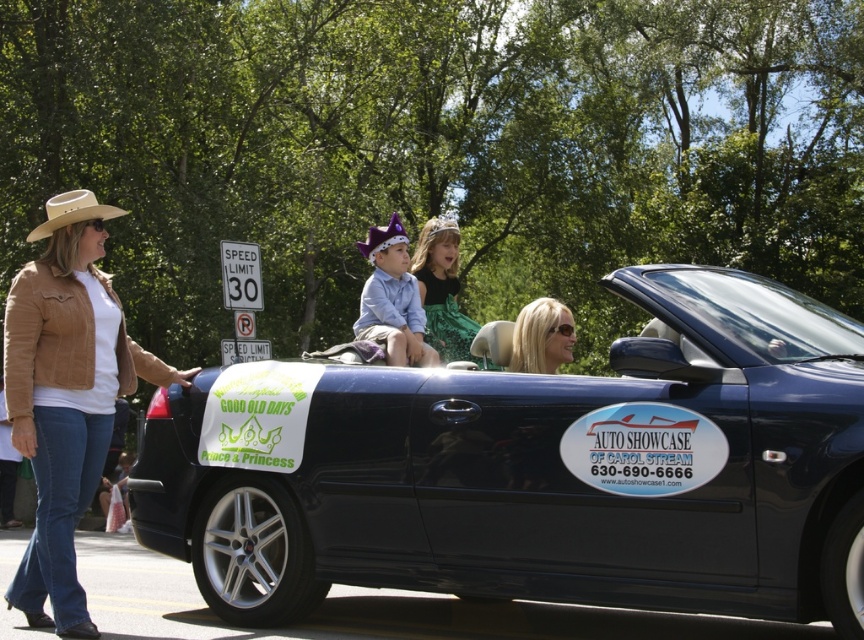
Question: Which object is farther from the camera taking this photo?

Choices:
 (A) shiny black convertible at center
 (B) tan leather jacket at left
 (C) blonde hair at center
 (D) beige felt cowboy hat at left

Answer: (C)

Question: Does shiny black convertible at center have a lesser width compared to green satin dress at center?

Choices:
 (A) no
 (B) yes

Answer: (A)

Question: Considering the relative positions of blonde hair at center and beige felt cowboy hat at left in the image provided, where is blonde hair at center located with respect to beige felt cowboy hat at left?

Choices:
 (A) above
 (B) below

Answer: (B)

Question: Which object is farther from the camera taking this photo?

Choices:
 (A) shiny black convertible at center
 (B) tan leather jacket at left

Answer: (B)

Question: Estimate the real-world distances between objects in this image. Which object is farther from the beige felt cowboy hat at left?

Choices:
 (A) blonde hair at center
 (B) tan leather jacket at left
 (C) shiny black convertible at center
 (D) green satin dress at center

Answer: (A)

Question: Is shiny black convertible at center to the right of tan leather jacket at left from the viewer's perspective?

Choices:
 (A) no
 (B) yes

Answer: (B)